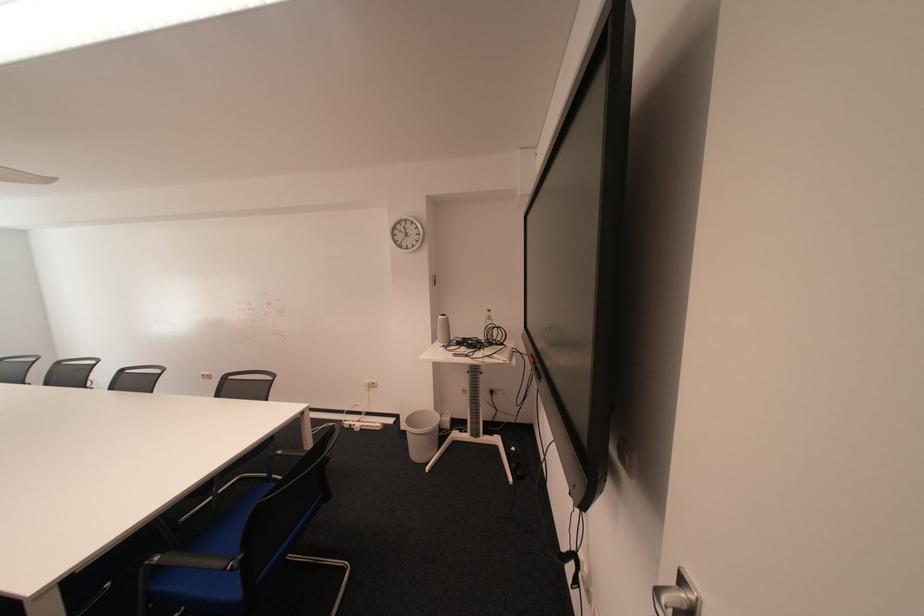
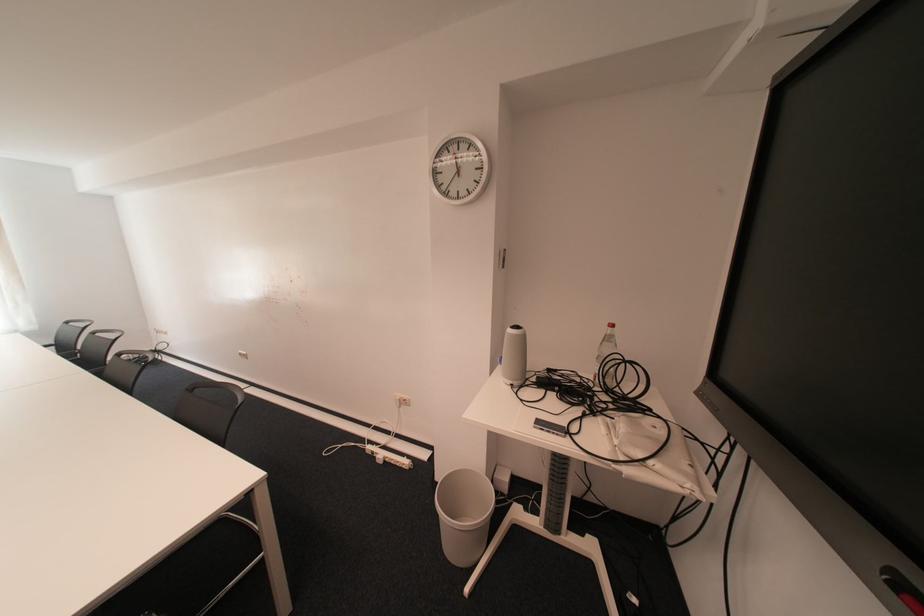
Question: The camera is either moving clockwise (left) or counter-clockwise (right) around the object. The first image is from the beginning of the video and the second image is from the end. Is the camera moving left or right when shooting the video?

Choices:
 (A) Left
 (B) Right

Answer: (B)